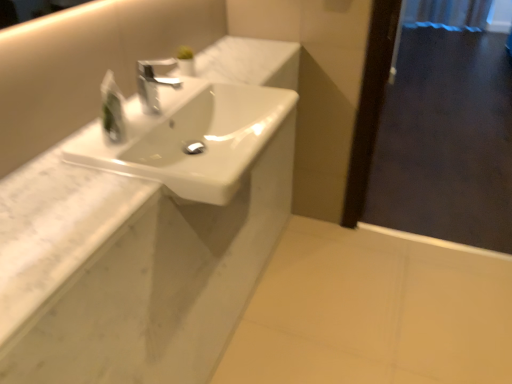
I want to click on empty space that is in between translucent plastic soap dispenser at upper left and satin nickel faucet at center, so click(x=139, y=125).